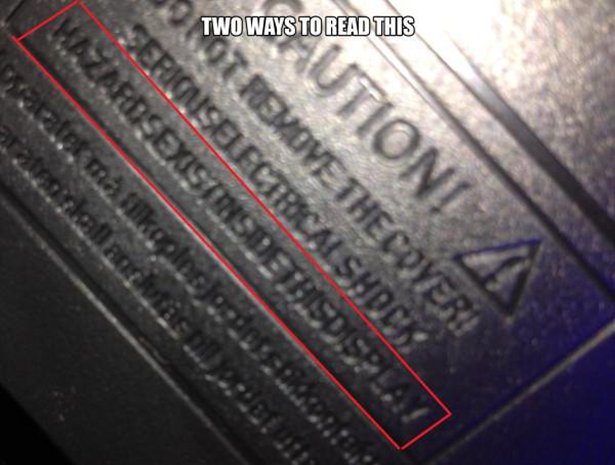
You are a GUI agent. You are given a task and a screenshot of the screen. Output one action in this format:
    pyautogui.click(x=<x>, y=<y>)
    Task: Click on the light
    
    Given the screenshot: What is the action you would take?
    pyautogui.click(x=442, y=24)